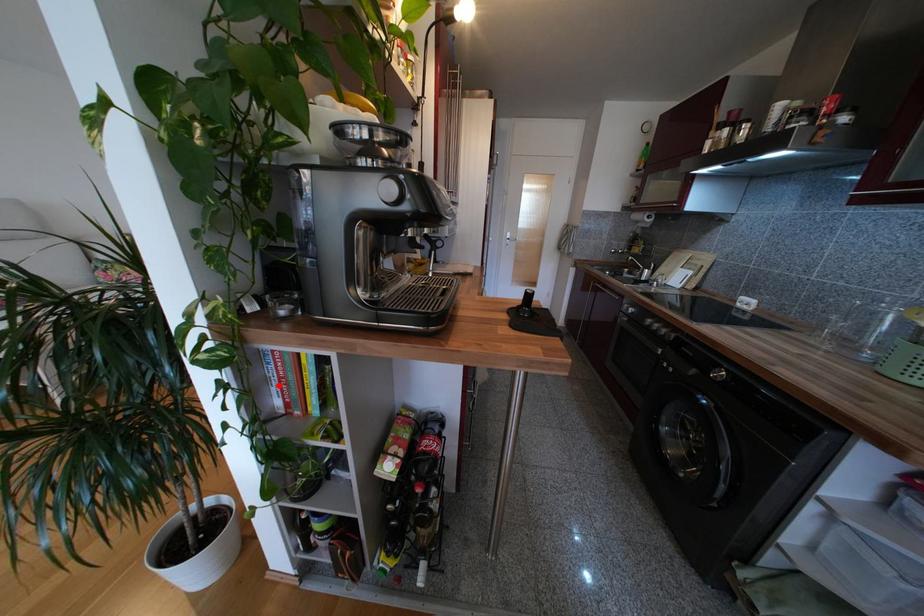
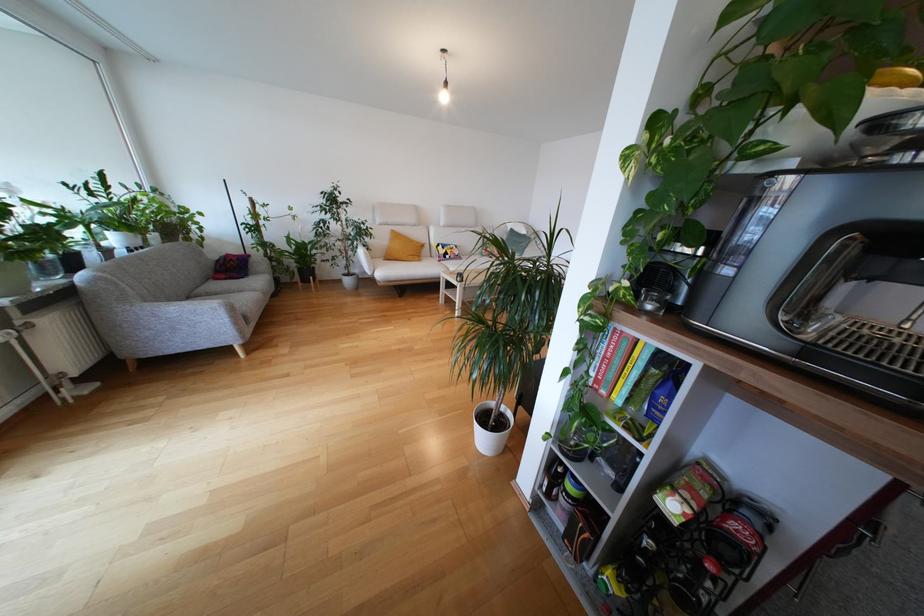
Where in the second image is the point corresponding to the highlighted location from the first image?

(601, 361)